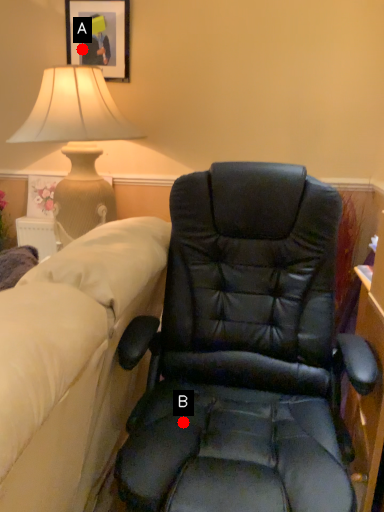
Question: Two points are circled on the image, labeled by A and B beside each circle. Which of the following is the closest to the observer?

Choices:
 (A) A is closer
 (B) B is closer

Answer: (B)